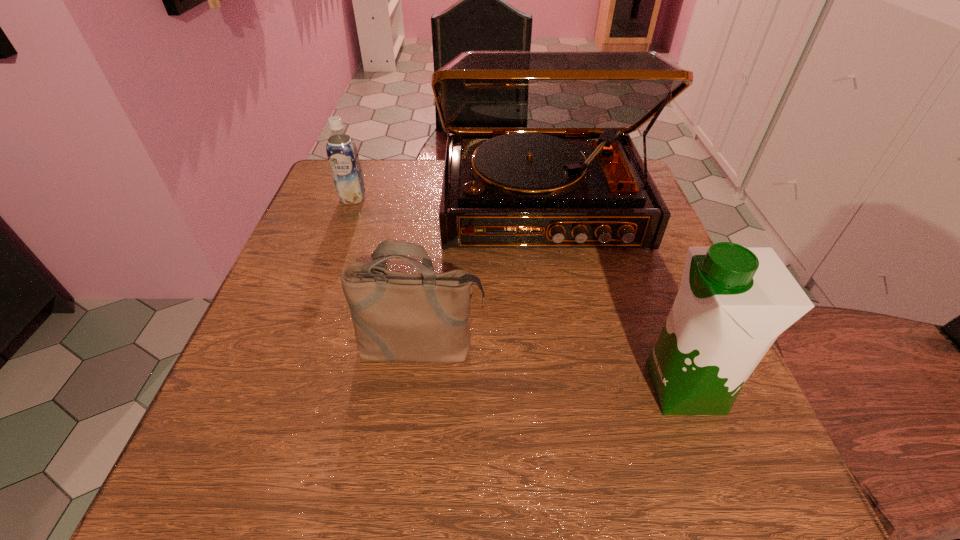
Find the location of a particular element. Image resolution: width=960 pixels, height=540 pixels. free spot at the near edge of the desktop is located at coordinates (356, 478).

Where is `vacant region at the left edge`? vacant region at the left edge is located at coordinates (309, 214).

In order to click on blank space at the right edge in this screenshot , I will do `click(615, 271)`.

Identify the location of empty space that is in between the tallest object and the shoulder bag. This screenshot has width=960, height=540. (481, 276).

This screenshot has width=960, height=540. Identify the location of unoccupied area between the shoulder bag and the taller soya milk. pos(553,368).

The image size is (960, 540). Find the location of `blank region between the taller soya milk and the record player`. blank region between the taller soya milk and the record player is located at coordinates (613, 296).

You are a GUI agent. You are given a task and a screenshot of the screen. Output one action in this format:
    pyautogui.click(x=<x>, y=<y>)
    Task: Click on the unoccupied area between the shoulder bag and the record player
    This screenshot has height=540, width=960.
    Given the screenshot: What is the action you would take?
    pyautogui.click(x=481, y=276)

This screenshot has height=540, width=960. Identify the location of object that ranks as the third closest to the leftmost object. (733, 302).

Select which object is the closest to the shorter soya milk. Please provide its 2D coordinates. Your answer should be formatted as a tuple, i.e. [(x, y)], where the tuple contains the x and y coordinates of a point satisfying the conditions above.

[(538, 155)]